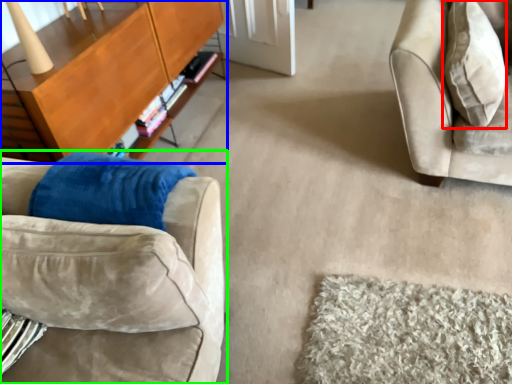
Question: Considering the real-world distances, which object is closest to throw pillow (highlighted by a red box)? table (highlighted by a blue box) or studio couch (highlighted by a green box).

Choices:
 (A) table
 (B) studio couch

Answer: (B)